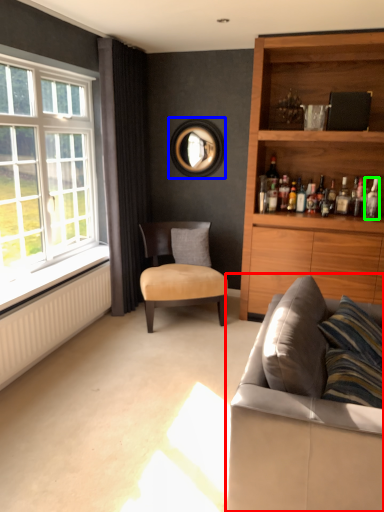
Question: Based on their relative distances, which object is nearer to studio couch (highlighted by a red box)? Choose from picture frame (highlighted by a blue box) and bottle (highlighted by a green box).

Choices:
 (A) picture frame
 (B) bottle

Answer: (B)